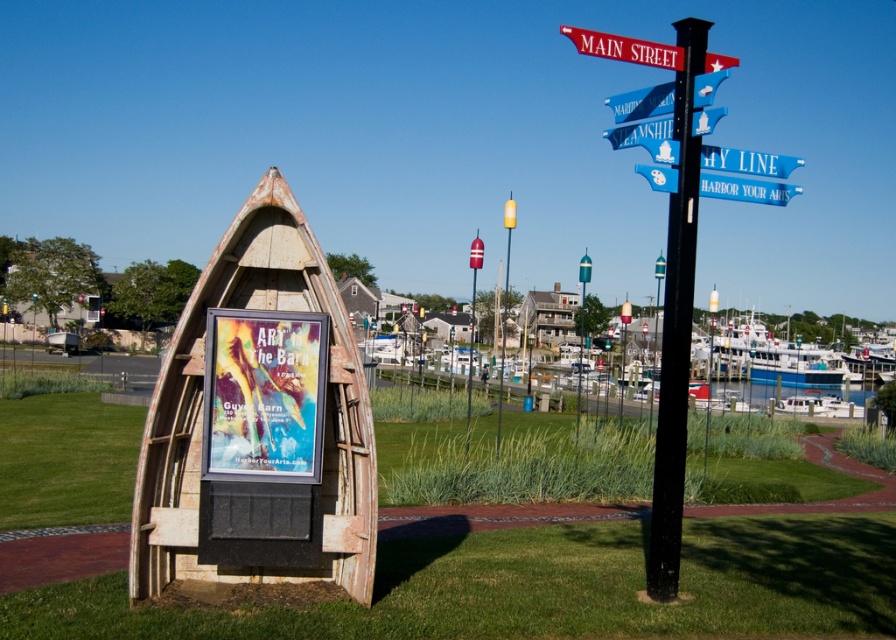
You are standing at the point labeled point (782, 164) and want to walk towards the point labeled point (533, 300). Which direction should you face to move directly towards it?

To move directly from point (782, 164) to point (533, 300), you should face southwest since point (782, 164) is in front of point (533, 300).

You are an artist standing in front of the rusty wood canoe at center and the blue painted wood street sign at upper right. You want to place a new artwork between them. Which object should you position the artwork closer to so it is more visible to people walking by?

The artwork should be placed closer to the rusty wood canoe at center because it is closer to the viewer, making the artwork more visible to passersby.

Based on the scene description, where is the black metal pole at center located in the image?

The black metal pole at center is located at point (x=676, y=326) in the image.